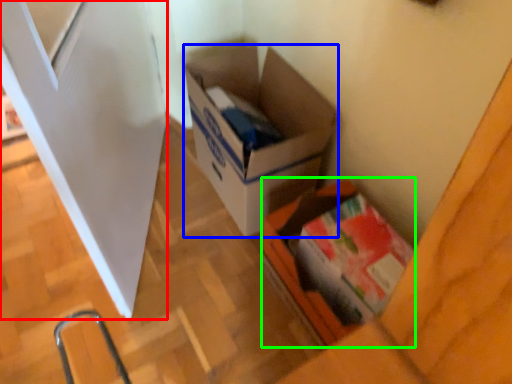
Question: Considering the real-world distances, which object is farthest from screen door (highlighted by a red box)? box (highlighted by a blue box) or box (highlighted by a green box)?

Choices:
 (A) box
 (B) box

Answer: (B)